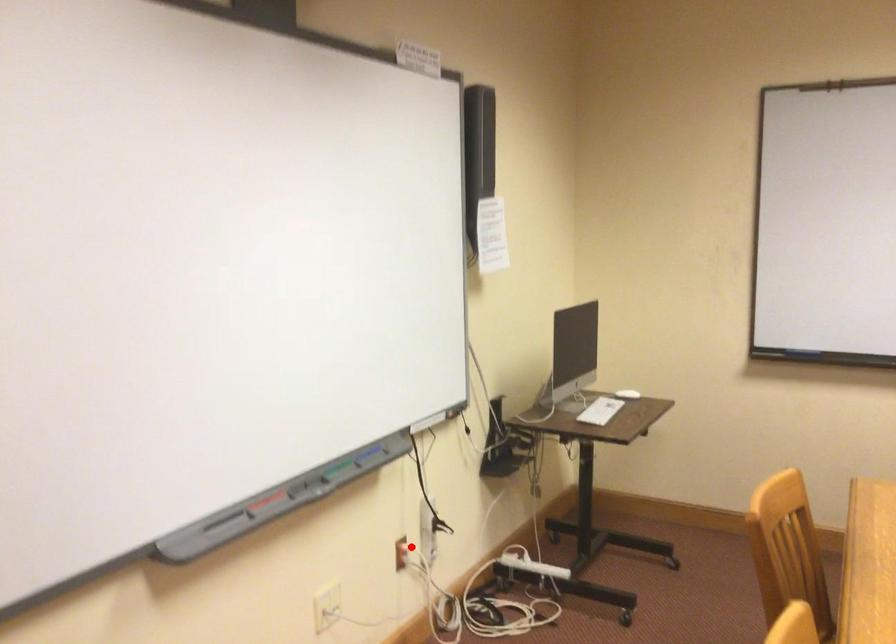
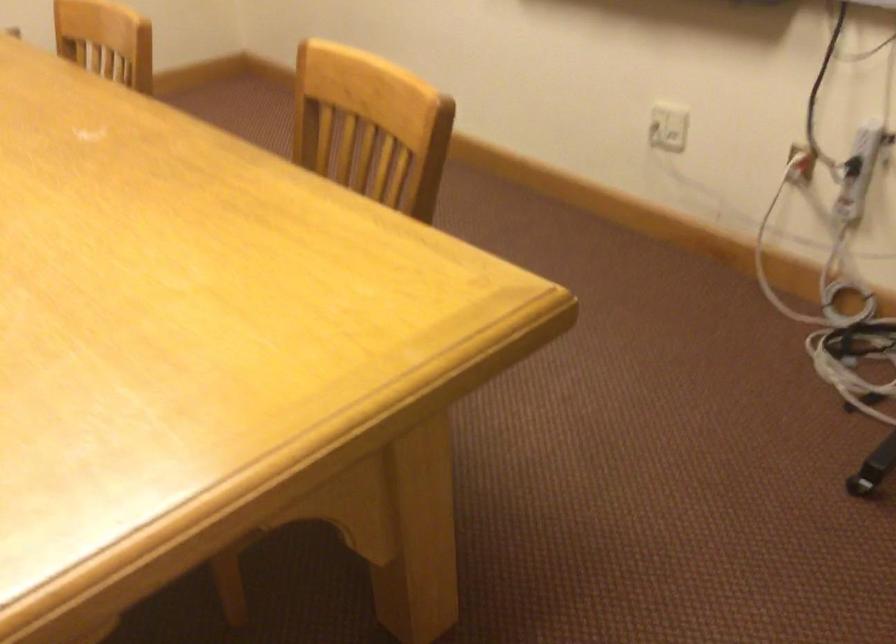
Find the pixel in the second image that matches the highlighted location in the first image.

(800, 164)